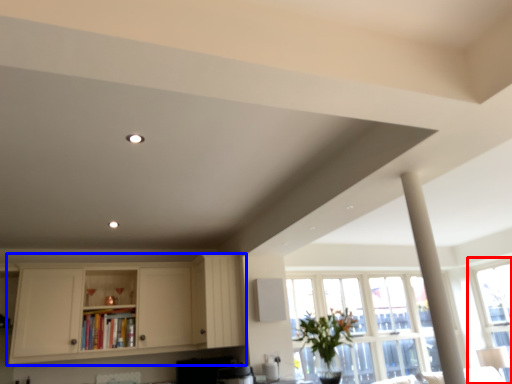
Question: Among these objects, which one is nearest to the camera, window (highlighted by a red box) or cabinetry (highlighted by a blue box)?

Choices:
 (A) window
 (B) cabinetry

Answer: (B)